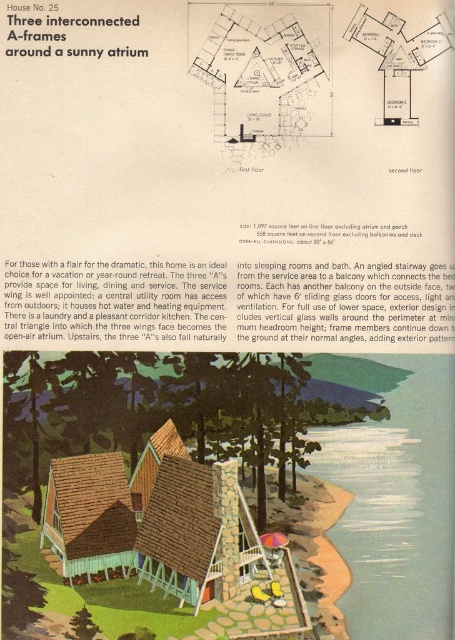
Does brown shingles at center appear over brown shingles at lower left?

Correct, brown shingles at center is located above brown shingles at lower left.

This screenshot has height=640, width=455. What are the coordinates of `brown shingles at center` in the screenshot? It's located at (136, 516).

This screenshot has height=640, width=455. Find the location of `brown shingles at center`. brown shingles at center is located at coordinates (136, 516).